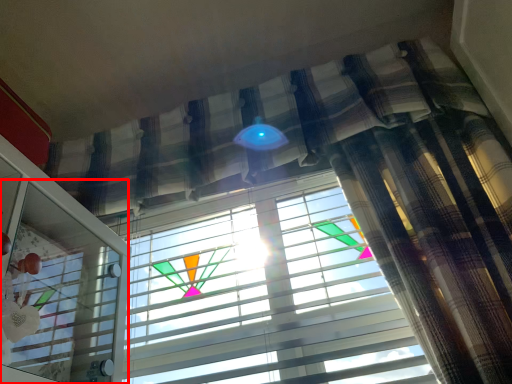
Question: From the image's perspective, what is the correct spatial positioning of screen door (annotated by the red box) in reference to window blind?

Choices:
 (A) below
 (B) above

Answer: (B)